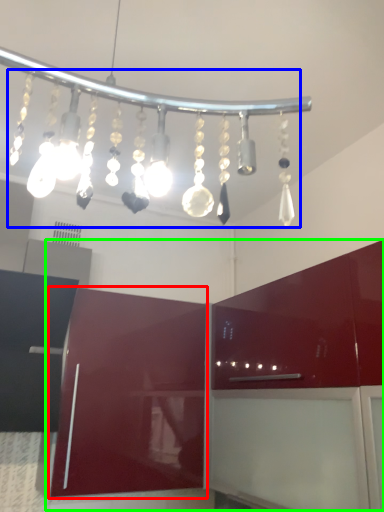
Question: Based on their relative distances, which object is farther from cabinetry (highlighted by a red box)? Choose from chandelier (highlighted by a blue box) and cabinetry (highlighted by a green box).

Choices:
 (A) chandelier
 (B) cabinetry

Answer: (A)